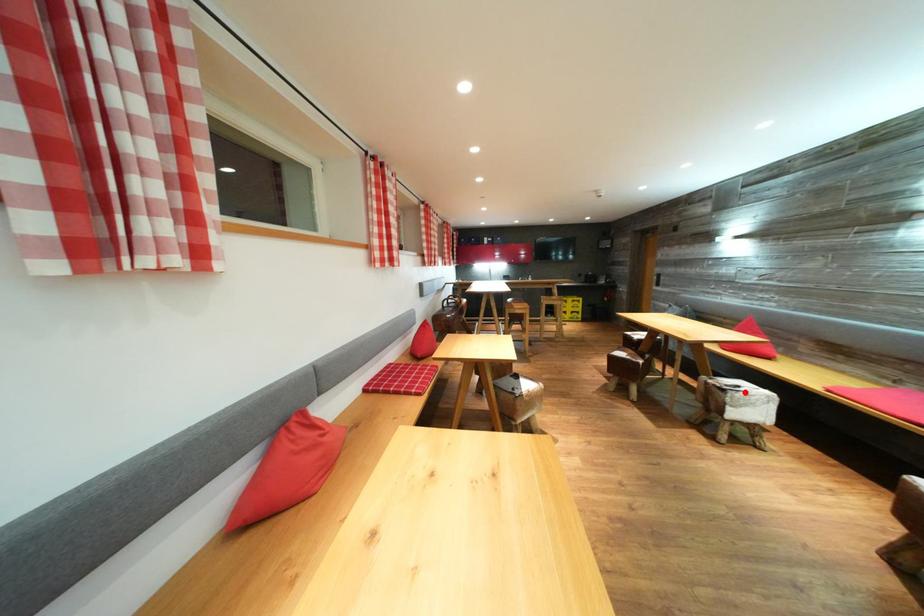
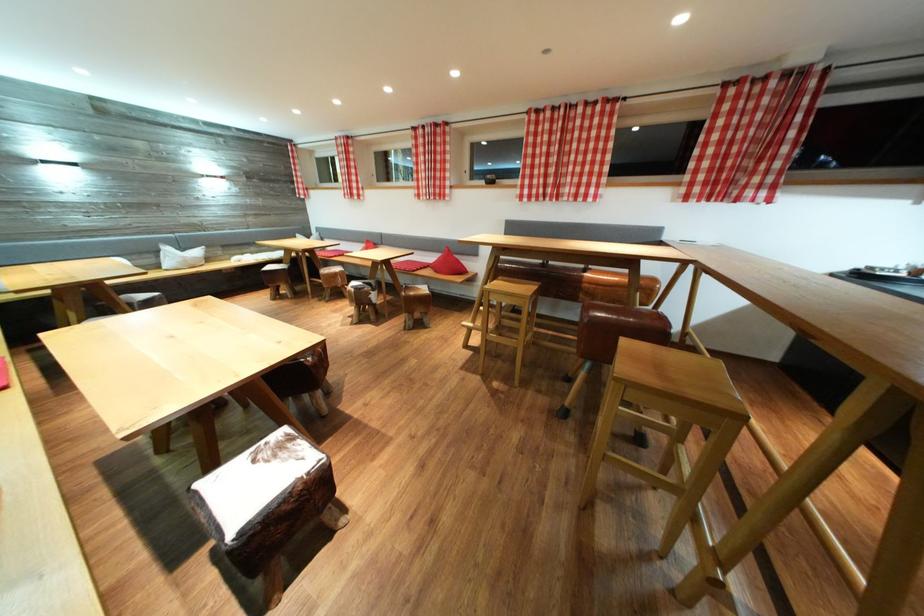
Question: I am providing you with two images of the same scene from different viewpoints. A red point is marked on the first image. Can you still see the location of the red point in image 2?

Choices:
 (A) Yes
 (B) No

Answer: (B)